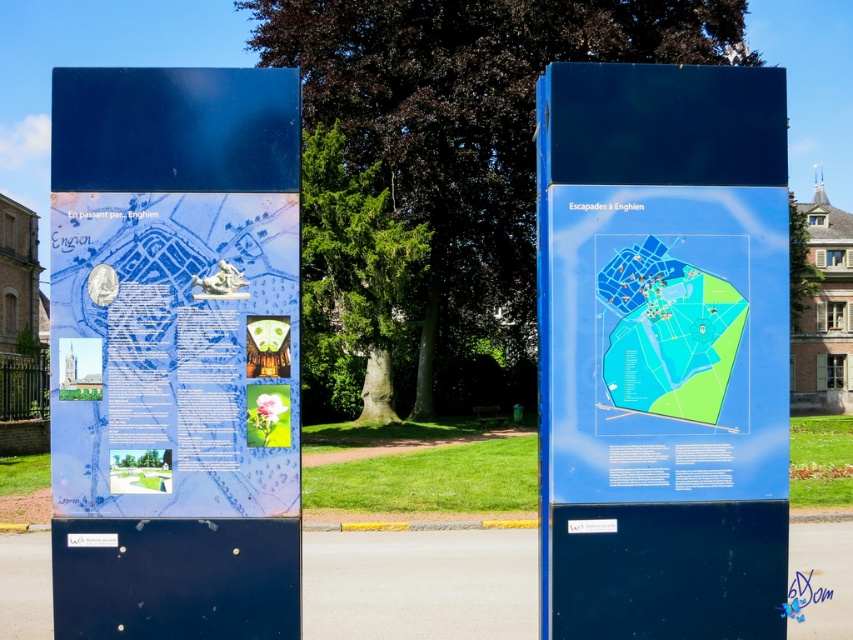
Is point (138, 388) positioned before point (670, 387)?

Yes, point (138, 388) is in front of point (670, 387).

Can you confirm if blue glossy poster at left is shorter than transparent plastic map at center?

Incorrect, blue glossy poster at left's height does not fall short of transparent plastic map at center's.

Identify the location of blue glossy poster at left. The width and height of the screenshot is (853, 640). (173, 355).

The width and height of the screenshot is (853, 640). Describe the element at coordinates (662, 349) in the screenshot. I see `blue glossy map at center` at that location.

Is point (750, 257) less distant than point (61, 204)?

That is False.

Between point (589, 208) and point (173, 305), which one is positioned in front?

Positioned in front is point (173, 305).

At what (x,y) coordinates should I click in order to perform the action: click on blue glossy map at center. Please return your answer as a coordinate pair (x, y). The width and height of the screenshot is (853, 640). Looking at the image, I should click on (662, 349).

Does point (634, 230) come farther from viewer compared to point (674, 296)?

No, (634, 230) is closer to viewer.

From the picture: Who is more distant from viewer, (592, 134) or (618, 259)?

Positioned behind is point (592, 134).

Which is behind, point (726, 88) or point (651, 257)?

The point (726, 88) is more distant.

This screenshot has width=853, height=640. Find the location of `blue glossy map at center`. blue glossy map at center is located at coordinates (662, 349).